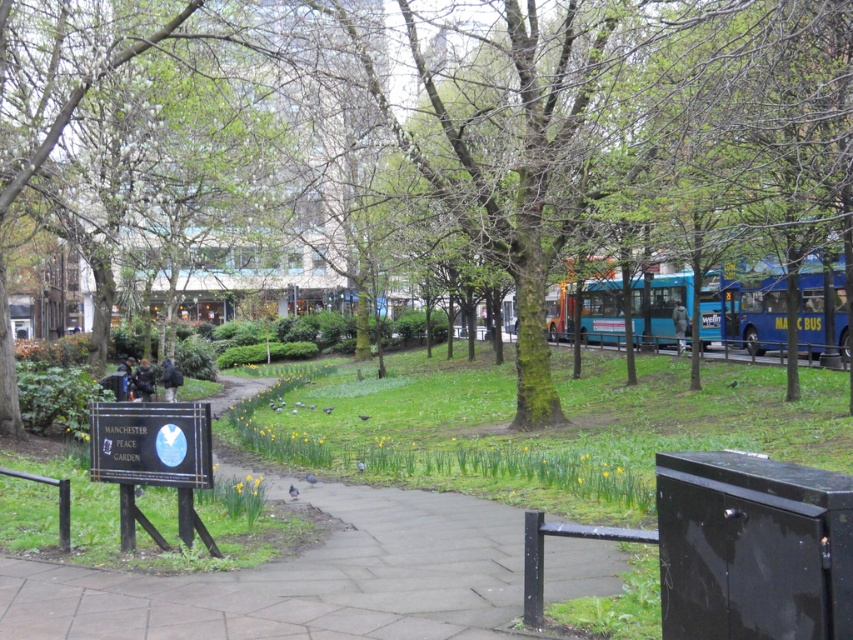
Does green mossy tree at center appear on the left side of blue metallic bus at center?

Indeed, green mossy tree at center is positioned on the left side of blue metallic bus at center.

Which is above, green mossy tree at center or blue metallic bus at center?

green mossy tree at center

Describe the element at coordinates (397, 122) in the screenshot. I see `green mossy tree at center` at that location.

The height and width of the screenshot is (640, 853). Find the location of `green mossy tree at center`. green mossy tree at center is located at coordinates (397, 122).

Does wooden sign at lower left have a lesser width compared to blue metallic bus at center?

Correct, wooden sign at lower left's width is less than blue metallic bus at center's.

Can you confirm if wooden sign at lower left is positioned to the right of blue metallic bus at center?

Incorrect, wooden sign at lower left is not on the right side of blue metallic bus at center.

Which is behind, point (128, 540) or point (549, 330)?

The point (549, 330) is more distant.

You are a GUI agent. You are given a task and a screenshot of the screen. Output one action in this format:
    pyautogui.click(x=<x>, y=<y>)
    Task: Click on the wooden sign at lower left
    This screenshot has height=640, width=853.
    Given the screenshot: What is the action you would take?
    pyautogui.click(x=154, y=460)

From the picture: Who is lower down, green mossy tree at center or blue metallic bus at right?

blue metallic bus at right

Does green mossy tree at center come in front of blue metallic bus at right?

Yes, green mossy tree at center is closer to the viewer.

Does point (648, 36) come behind point (798, 314)?

No, (648, 36) is in front of (798, 314).

The width and height of the screenshot is (853, 640). What are the coordinates of `green mossy tree at center` in the screenshot? It's located at (397, 122).